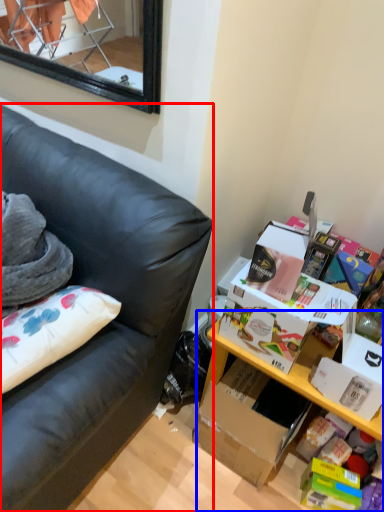
Question: Which object is closer to the camera taking this photo, studio couch (highlighted by a red box) or table (highlighted by a blue box)?

Choices:
 (A) studio couch
 (B) table

Answer: (A)